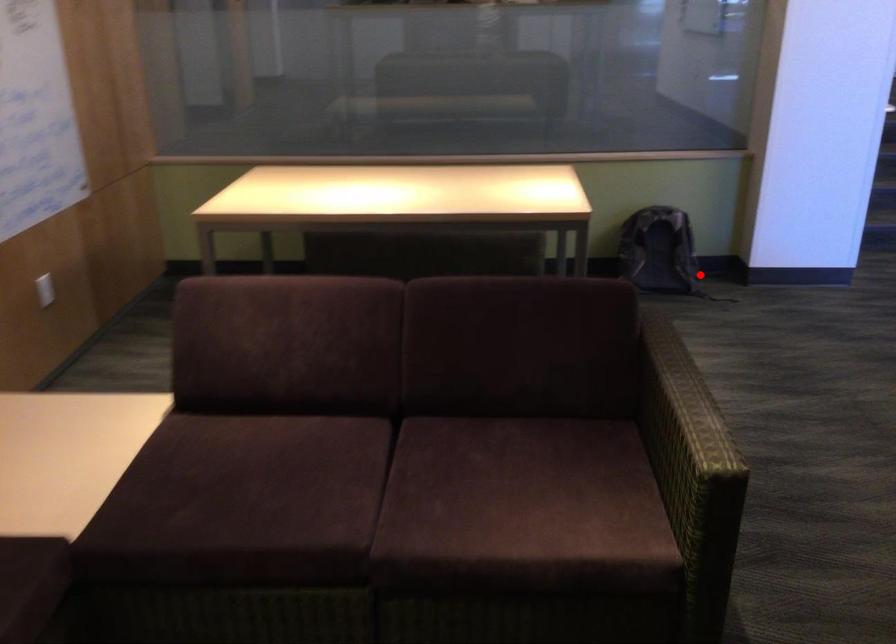
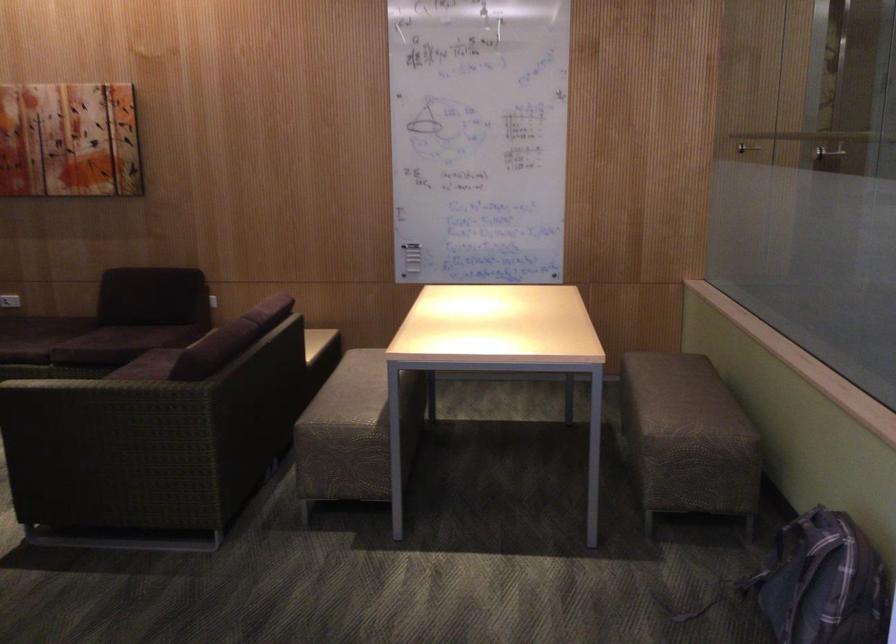
Find the pixel in the second image that matches the highlighted location in the first image.

(823, 583)